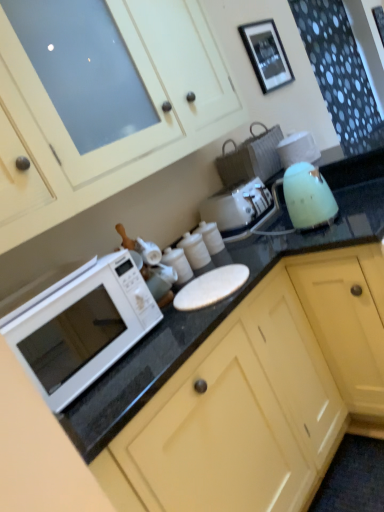
Question: In terms of size, does white glossy microwave at left appear bigger or smaller than matte yellow cabinet at lower center, which is the first cabinetry from bottom to top?

Choices:
 (A) small
 (B) big

Answer: (A)

Question: Do you think white glossy microwave at left is within matte yellow cabinet at lower center, the second cabinetry positioned from the top, or outside of it?

Choices:
 (A) inside
 (B) outside

Answer: (A)

Question: Which object is the closest to the black matte picture frame at upper center?

Choices:
 (A) white glossy microwave at left
 (B) matte yellow cabinet at lower center, the second cabinetry positioned from the top
 (C) matte white cabinet at upper center, the 1th cabinetry from the top

Answer: (C)

Question: Which object is the farthest from the white glossy microwave at left?

Choices:
 (A) black matte picture frame at upper center
 (B) matte white cabinet at upper center, the 1th cabinetry from the top
 (C) matte yellow cabinet at lower center, which is the first cabinetry from bottom to top

Answer: (A)